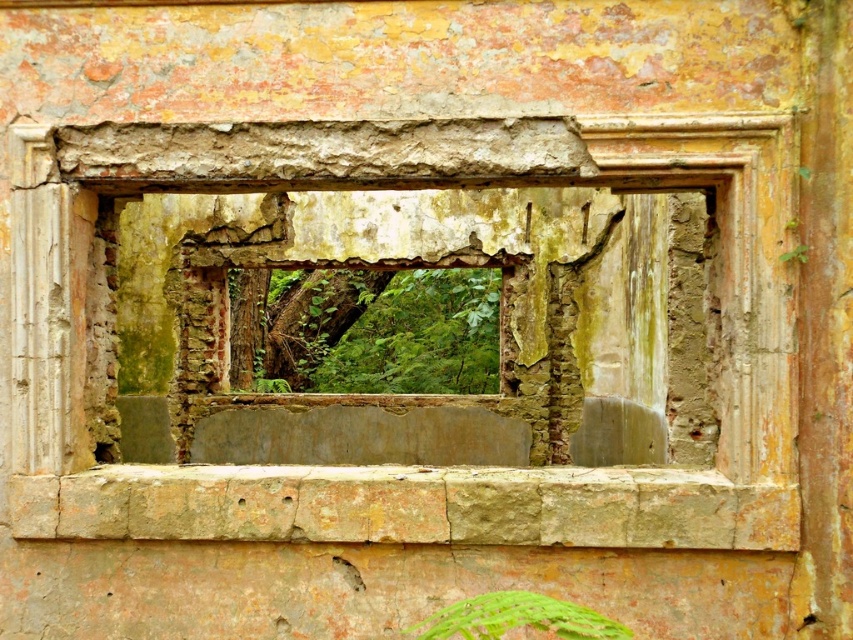
Question: Which point appears farthest from the camera in this image?

Choices:
 (A) (440, 620)
 (B) (496, 156)
 (C) (367, 372)

Answer: (C)

Question: Is rusty concrete window frame at center wider than green leafy plant at lower center?

Choices:
 (A) yes
 (B) no

Answer: (A)

Question: Which object appears farthest from the camera in this image?

Choices:
 (A) rusty concrete window frame at center
 (B) green leafy plant at lower center
 (C) green leafy tree at center

Answer: (C)

Question: Does green leafy tree at center come in front of green leafy plant at lower center?

Choices:
 (A) no
 (B) yes

Answer: (A)

Question: Estimate the real-world distances between objects in this image. Which object is farther from the rusty concrete window frame at center?

Choices:
 (A) green leafy tree at center
 (B) green leafy plant at lower center

Answer: (A)

Question: Does rusty concrete window frame at center appear under green leafy plant at lower center?

Choices:
 (A) yes
 (B) no

Answer: (B)